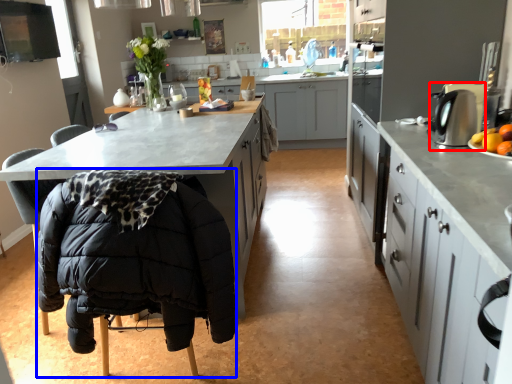
Question: Which object appears farthest to the camera in this image, kitchen appliance (highlighted by a red box) or folding chair (highlighted by a blue box)?

Choices:
 (A) kitchen appliance
 (B) folding chair

Answer: (A)